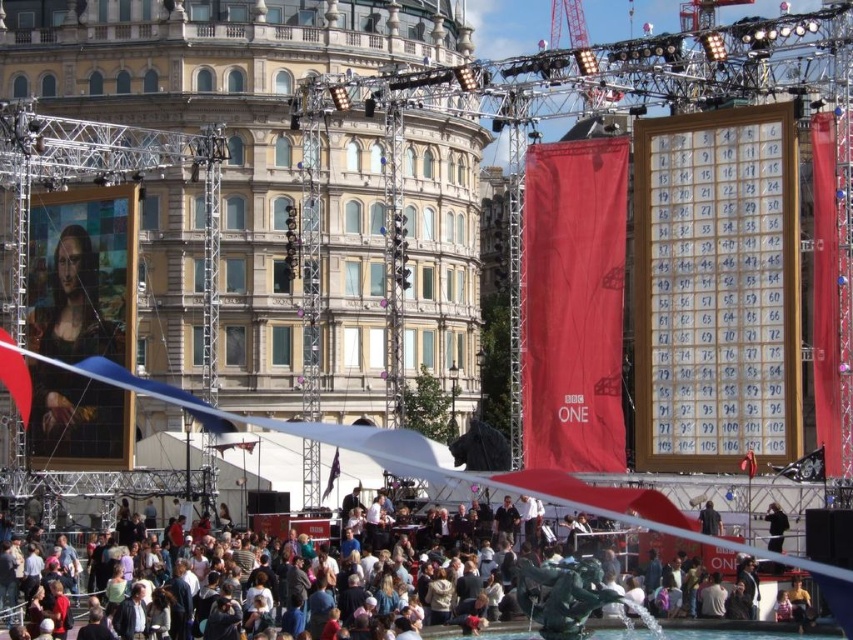
You are standing at the center of the event and want to move towards both points. Which point, point (595, 579) or point (769, 520), will you reach first?

Point (595, 579) is closer to the viewer than point (769, 520), so you will reach point (595, 579) first.

You are an event organizer who needs to ensure that all elements on stage are visible to the audience. Considering the black fabric person at center and the dark blue fabric at center, which one might block the view of the other?

The black fabric person at center is taller than the dark blue fabric at center, so it might block the view of the dark blue fabric at center.

You are an event organizer who needs to place a 3 meter wide banner between the dark gray fabric crowd at lower center and the dark blue fabric at center. Can the banner fit in the space between them?

The distance between the dark gray fabric crowd at lower center and the dark blue fabric at center is 5.64 meters. Since the banner is 3 meters wide, it can easily fit within the available space.